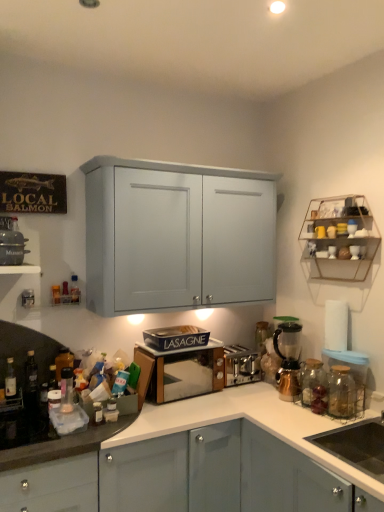
Question: Considering the positions of metallic copper coffee machine at right and translucent plastic bottle at left, positioned as the 5th bottle in right-to-left order, in the image, is metallic copper coffee machine at right wider or thinner than translucent plastic bottle at left, positioned as the 5th bottle in right-to-left order,?

Choices:
 (A) wide
 (B) thin

Answer: (A)

Question: From a real-world perspective, is metallic copper coffee machine at right physically located above or below translucent plastic bottle at left, which is the third bottle in back-to-front order?

Choices:
 (A) below
 (B) above

Answer: (B)

Question: Which object is the farthest from the black matte sink at lower right?

Choices:
 (A) satin silver toaster at center, the third appliance viewed from the top
 (B) wooden microwave at center, acting as the 2th appliance starting from the top
 (C) matte black pot at left, positioned as the 3th appliance in right-to-left order
 (D) metallic copper coffee machine at right
 (E) translucent plastic bottle at center, which is the 1th bottle in back-to-front order

Answer: (C)

Question: Estimate the real-world distances between objects in this image. Which object is closer to the translucent plastic bottle at center, the 4th bottle when ordered from left to right?

Choices:
 (A) transparent glass jar at right, acting as the first glass jar starting from the right
 (B) matte black pot at left, the third appliance positioned from the bottom
 (C) wooden microwave at center, which is the 2th appliance in back-to-front order
 (D) satin silver toaster at center, positioned as the first appliance in bottom-to-top order
 (E) metallic copper coffee machine at right

Answer: (B)